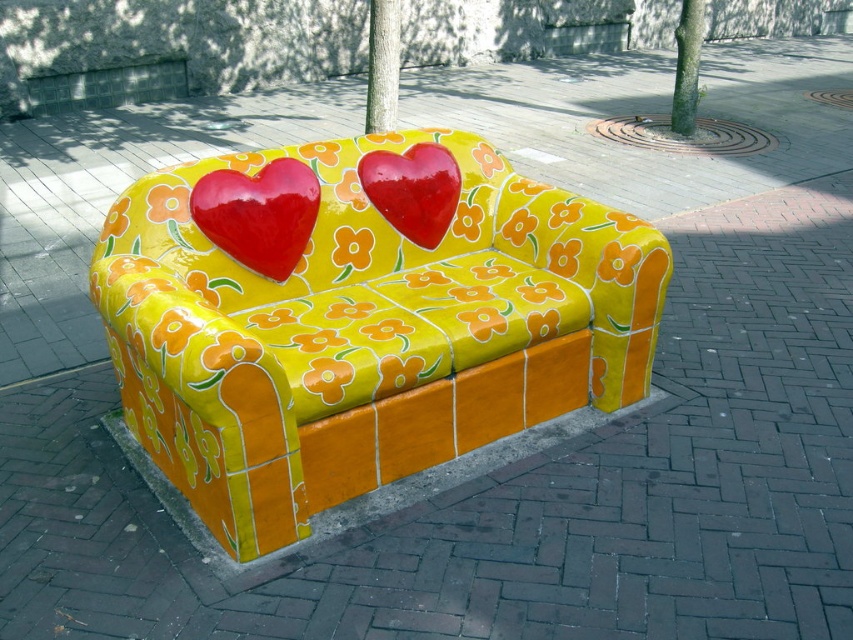
Question: Which point is closer to the camera?

Choices:
 (A) (314, 538)
 (B) (224, 248)
 (C) (451, 173)
 (D) (123, 301)

Answer: (D)

Question: Is orange tile curb at lower center thinner than glossy red heart at center?

Choices:
 (A) yes
 (B) no

Answer: (B)

Question: Which point is farther to the camera?

Choices:
 (A) glossy red heart at center
 (B) orange tile curb at lower center
 (C) yellow glossy couch at center
 (D) glossy ceramic heart at center

Answer: (D)

Question: Is glossy red heart at center below glossy ceramic heart at center?

Choices:
 (A) no
 (B) yes

Answer: (B)

Question: Observing the image, what is the correct spatial positioning of glossy red heart at center in reference to glossy ceramic heart at center?

Choices:
 (A) left
 (B) right

Answer: (A)

Question: Which point is farther to the camera?

Choices:
 (A) glossy ceramic heart at center
 (B) orange tile curb at lower center

Answer: (A)